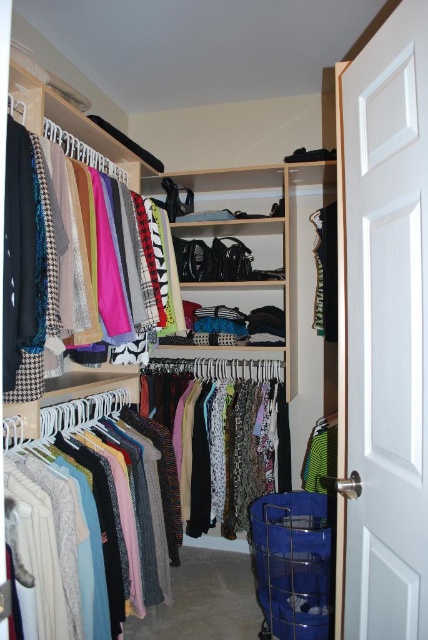
You are moving a large box into the closet and need to place it somewhere. The box is 1.2 meters wide. Looking at the image, can you fit the box between the matte wooden closet at center and the green jersey at center?

The matte wooden closet at center is larger in size than the green jersey at center, so there might be enough space to fit the box between them. However, since the exact distance isn t provided, it s best to check the actual dimensions before placing the box.

You are organizing your closet and want to retrieve the knitwear at left and the green jersey at center. Which item will you reach first without moving any other clothes?

The knitwear at left is closer to the viewer than the green jersey at center, so you will reach the knitwear at left first.